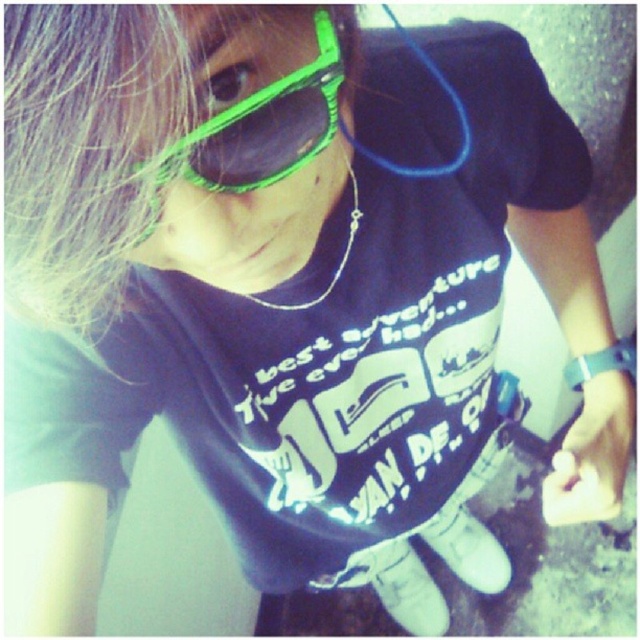
Who is shorter, blonde hair at upper left or green plastic goggles at upper center?

green plastic goggles at upper center

The image size is (640, 640). I want to click on blonde hair at upper left, so click(83, 144).